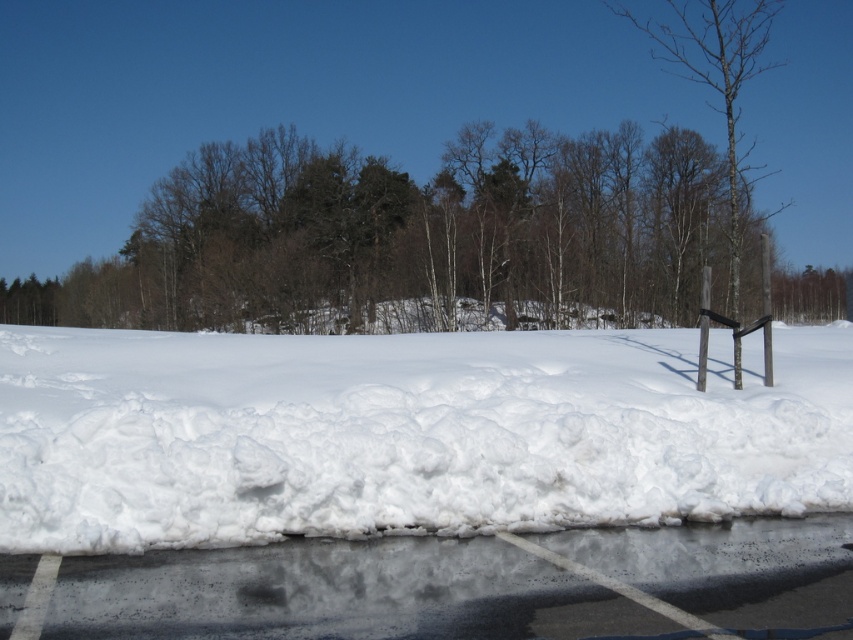
Question: Which object appears farthest from the camera in this image?

Choices:
 (A) white fluffy snow at center
 (B) black asphalt at lower center

Answer: (A)

Question: Among these objects, which one is nearest to the camera?

Choices:
 (A) black asphalt at lower center
 (B) white fluffy snow at center

Answer: (A)

Question: Is white fluffy snow at center to the left of black asphalt at lower center from the viewer's perspective?

Choices:
 (A) yes
 (B) no

Answer: (B)

Question: Which object is farther from the camera taking this photo?

Choices:
 (A) black asphalt at lower center
 (B) white fluffy snow at center

Answer: (B)

Question: Is white fluffy snow at center above black asphalt at lower center?

Choices:
 (A) no
 (B) yes

Answer: (B)

Question: Does white fluffy snow at center have a lesser width compared to black asphalt at lower center?

Choices:
 (A) no
 (B) yes

Answer: (A)